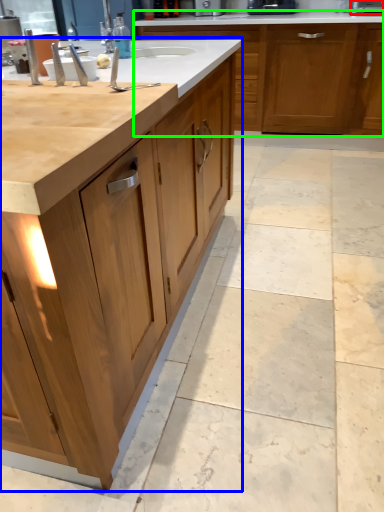
Question: Estimate the real-world distances between objects in this image. Which object is farther from appliance (highlighted by a red box), cabinetry (highlighted by a blue box) or cabinetry (highlighted by a green box)?

Choices:
 (A) cabinetry
 (B) cabinetry

Answer: (A)